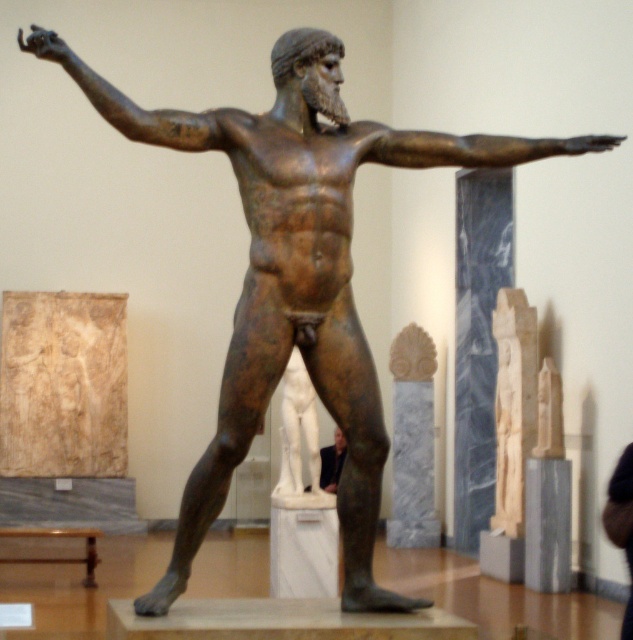
Question: Among these points, which one is farthest from the camera?

Choices:
 (A) (342, 440)
 (B) (482, 145)
 (C) (139, 136)

Answer: (A)

Question: Can you confirm if bronze arm at upper left is bigger than dark suit at center?

Choices:
 (A) yes
 (B) no

Answer: (A)

Question: Can you confirm if bronze arm at upper left is smaller than dark suit at center?

Choices:
 (A) yes
 (B) no

Answer: (B)

Question: Does bronze arm at upper left appear on the left side of dark suit at center?

Choices:
 (A) no
 (B) yes

Answer: (B)

Question: Which object is farther from the camera taking this photo?

Choices:
 (A) bronze muscular arm at center
 (B) dark suit at center

Answer: (B)

Question: Which point is farther to the camera?

Choices:
 (A) (329, 448)
 (B) (189, 138)
 (C) (367, 154)

Answer: (A)